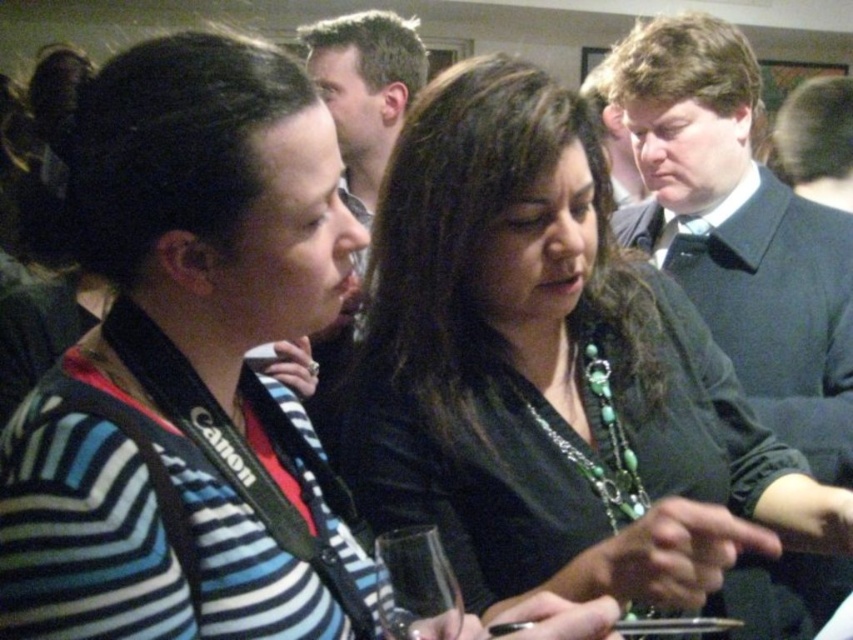
You are organizing a photo shoot and need to ensure that the striped sweater at center and the green beaded necklace at center are both visible in the frame. Based on their sizes, which object might require more space horizontally?

The striped sweater at center might require more space horizontally since it is wider than the green beaded necklace at center.

You are at a social event and want to take a photo of the striped sweater at center and the transparent glass at center. Since the background is blurry, which object should you focus on to ensure both are in focus?

The striped sweater at center is larger in size than transparent glass at center. To ensure both are in focus, focus on the striped sweater at center since it is closer to the camera.

Looking at this image, you are at a social gathering and want to place a small note between the striped sweater at center and the transparent glass at center. Based on their positions, where should you place the note?

The striped sweater at center is to the left of the transparent glass at center, so you should place the note between them on the right side of the striped sweater at center and the left side of the transparent glass at center.